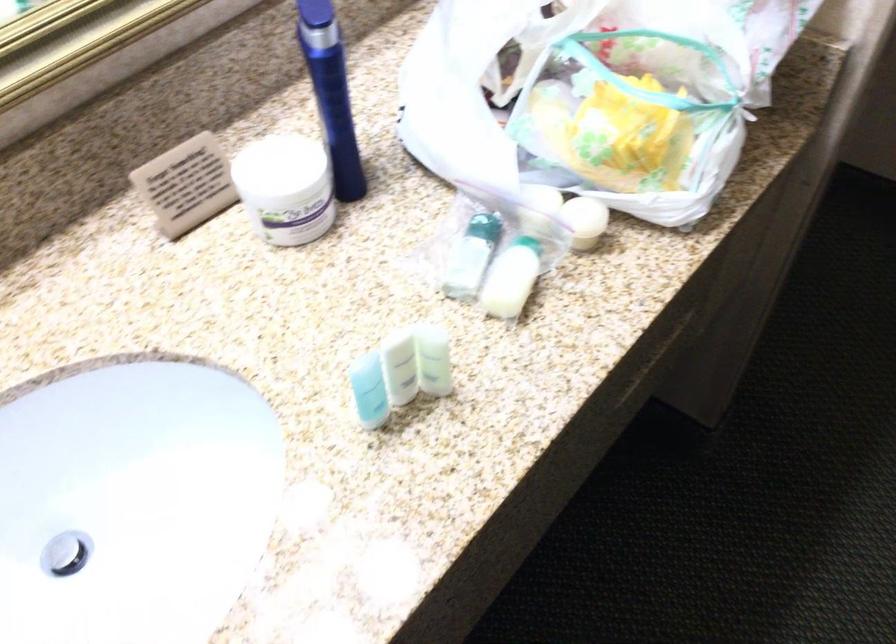
Where is `sink drain plug`? The height and width of the screenshot is (644, 896). sink drain plug is located at coordinates (65, 554).